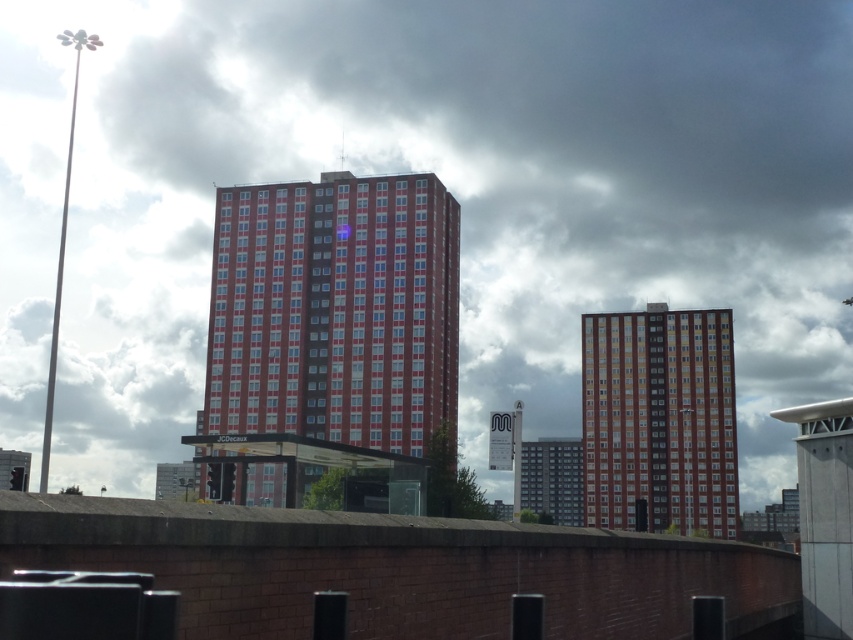
Is point (450, 358) in front of point (660, 422)?

Yes.

Is red brick building at center smaller than brick textured building at center?

Yes.

Locate an element on the screen. The height and width of the screenshot is (640, 853). red brick building at center is located at coordinates (335, 310).

Locate an element on the screen. red brick building at center is located at coordinates (335, 310).